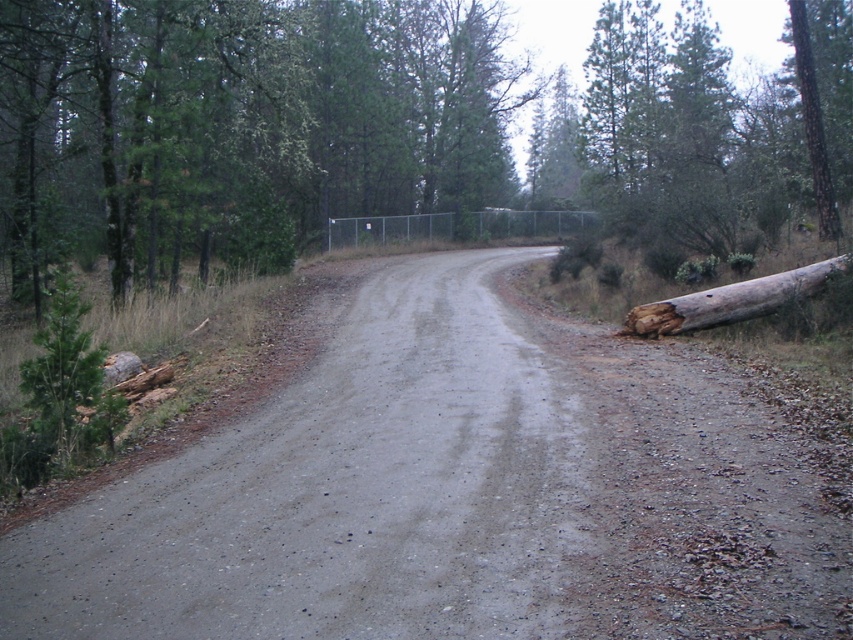
You are a hiker trying to cross the brown rough log at right. There is a brown rough tree trunk at upper right nearby. Which object is closer to you?

The brown rough log at right is closer to you than the brown rough tree trunk at upper right.

You are driving a truck that is 2 meters wide. You come across a section of the gray gravel road at center where the brown wood log at right is blocking part of the road. Can your truck safely pass through without hitting the log?

The gray gravel road at center is smaller than the brown wood log at right, so the road may not be wide enough for the truck to pass safely around the log. It is recommended to take an alternative route or check for a wider section of the road.

You are driving a truck with a width of 2.5 meters along the gray gravel road at center. There is a brown rough log at right blocking part of the road. Can your truck safely pass through the road without hitting the log?

The gray gravel road at center has a larger size compared to the brown rough log at right, so the truck can safely pass through the road without hitting the log since the road is wider than the log.